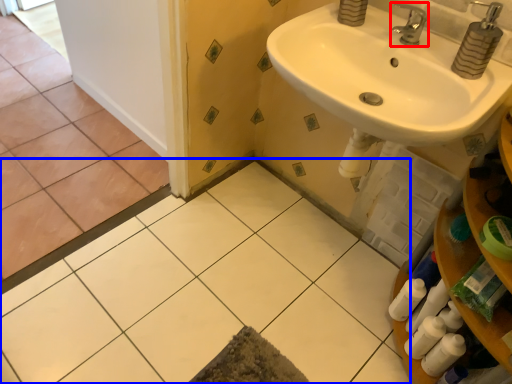
Question: Which point is further to the camera, tap (highlighted by a red box) or ceramic tile (highlighted by a blue box)?

Choices:
 (A) tap
 (B) ceramic tile

Answer: (A)